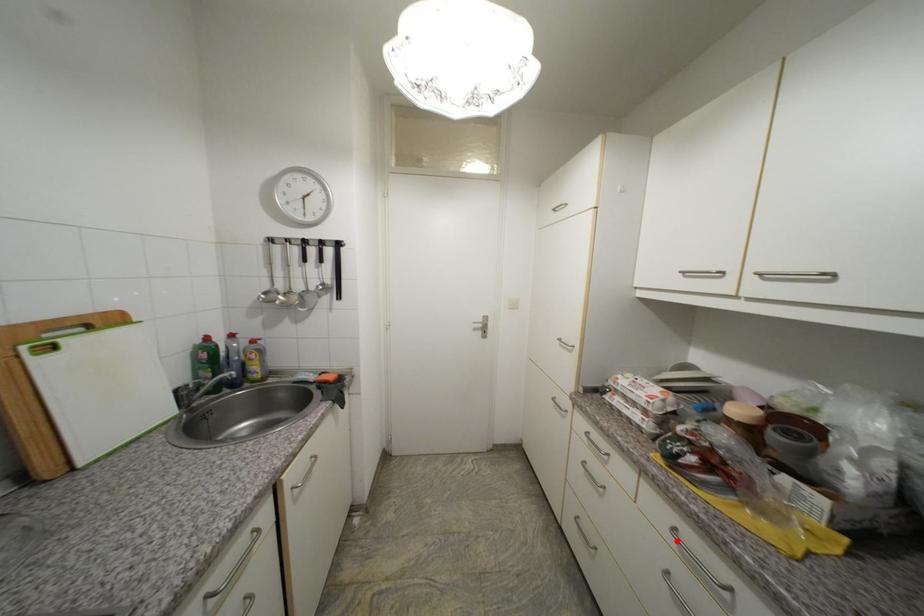
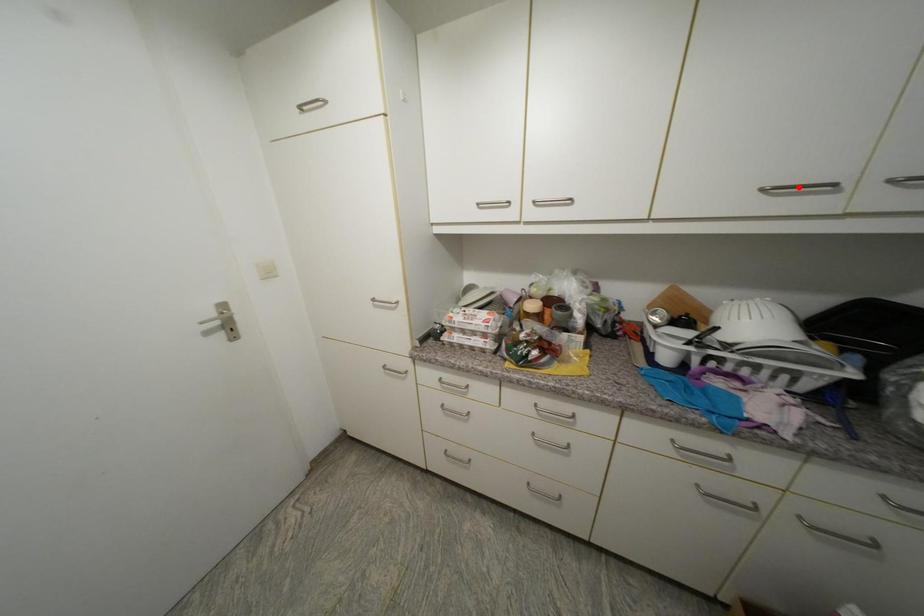
I am providing you with two images of the same scene from different viewpoints. A red point is marked on the first image and another point is marked on the second image. Is the marked point in image1 the same physical position as the marked point in image2?

No